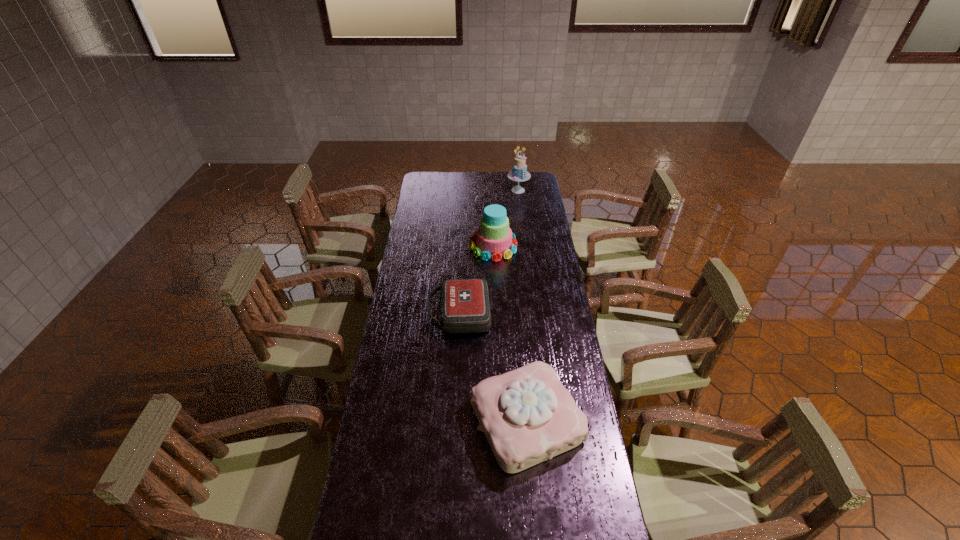
Find the location of a particular element. Image resolution: width=960 pixels, height=540 pixels. vacant region between the nearest object and the first-aid kit is located at coordinates (492, 367).

The width and height of the screenshot is (960, 540). Identify the location of vacant area between the third farthest object and the third tallest object. (492, 367).

Where is `empty space between the nearest object and the tallest cake`? This screenshot has width=960, height=540. empty space between the nearest object and the tallest cake is located at coordinates (522, 306).

Locate an element on the screen. This screenshot has width=960, height=540. the second closest object to the second tallest object is located at coordinates (519, 173).

Locate an element on the screen. Image resolution: width=960 pixels, height=540 pixels. the second closest object to the shortest object is located at coordinates (493, 238).

This screenshot has height=540, width=960. Identify the location of cake that is the closest to the shortest cake. (493, 238).

Where is `cake that stands as the third closest to the shortest object`? This screenshot has width=960, height=540. cake that stands as the third closest to the shortest object is located at coordinates (519, 173).

At what (x,y) coordinates should I click in order to perform the action: click on free location that satisfies the following two spatial constraints: 1. on the front side of the shortest object; 2. on the right side of the nearest cake. Please return your answer as a coordinate pair (x, y). The height and width of the screenshot is (540, 960). Looking at the image, I should click on (454, 421).